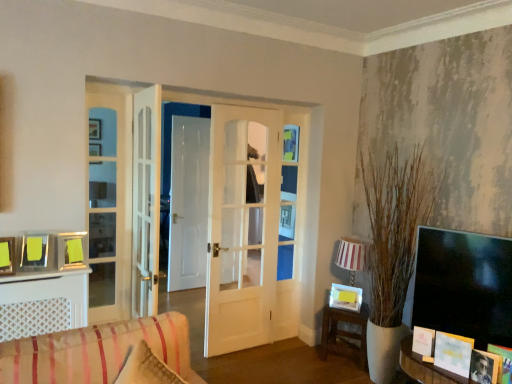
Identify the location of vacant location below wooden table at lower right (from a real-world perspective). (340, 361).